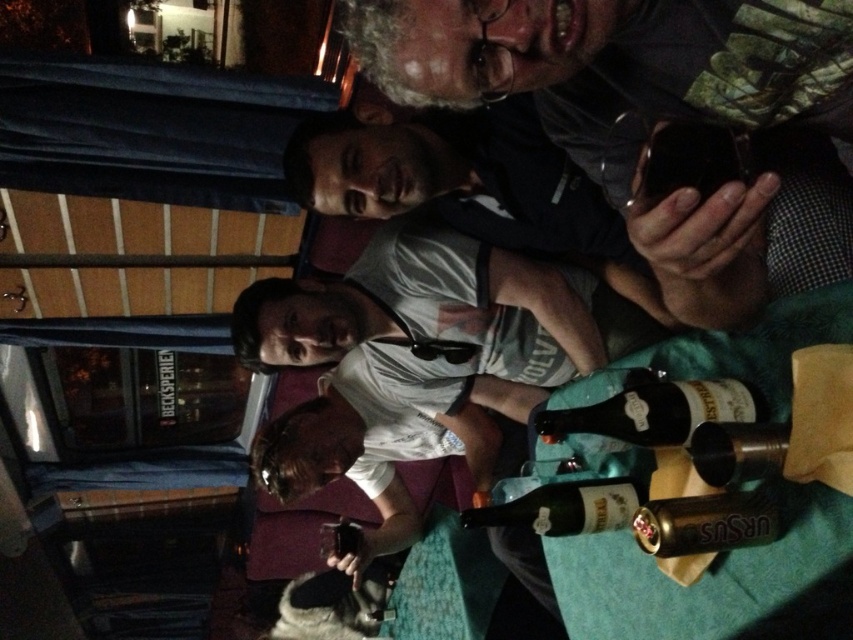
Who is more forward, (776, 512) or (706, 456)?

Positioned in front is point (706, 456).

Can you confirm if silver metallic can at lower right is positioned to the left of metallic silver bottle at center?

Yes, silver metallic can at lower right is to the left of metallic silver bottle at center.

What do you see at coordinates (705, 524) in the screenshot?
I see `silver metallic can at lower right` at bounding box center [705, 524].

Where is `silver metallic can at lower right`? The width and height of the screenshot is (853, 640). silver metallic can at lower right is located at coordinates (705, 524).

Image resolution: width=853 pixels, height=640 pixels. Describe the element at coordinates (633, 100) in the screenshot. I see `matte black phone at upper center` at that location.

Measure the distance between matte black phone at upper center and translucent glass bottle at center.

They are 10.73 inches apart.

The width and height of the screenshot is (853, 640). I want to click on matte black phone at upper center, so click(633, 100).

At what (x,y) coordinates should I click in order to perform the action: click on matte black phone at upper center. Please return your answer as a coordinate pair (x, y). The height and width of the screenshot is (640, 853). Looking at the image, I should click on (633, 100).

Who is more distant from viewer, (606,499) or (715,445)?

Point (606,499)

Is point (550, 531) in front of point (759, 454)?

No, (550, 531) is further to viewer.

Between point (549, 528) and point (730, 451), which one is positioned behind?

Positioned behind is point (549, 528).

Where is `translucent glass bottle at lower center`? translucent glass bottle at lower center is located at coordinates (566, 508).